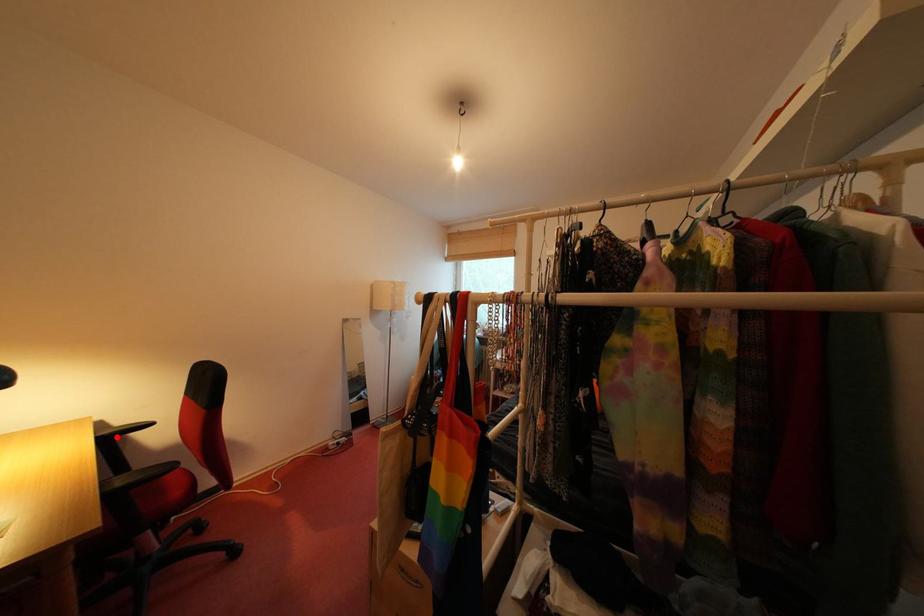
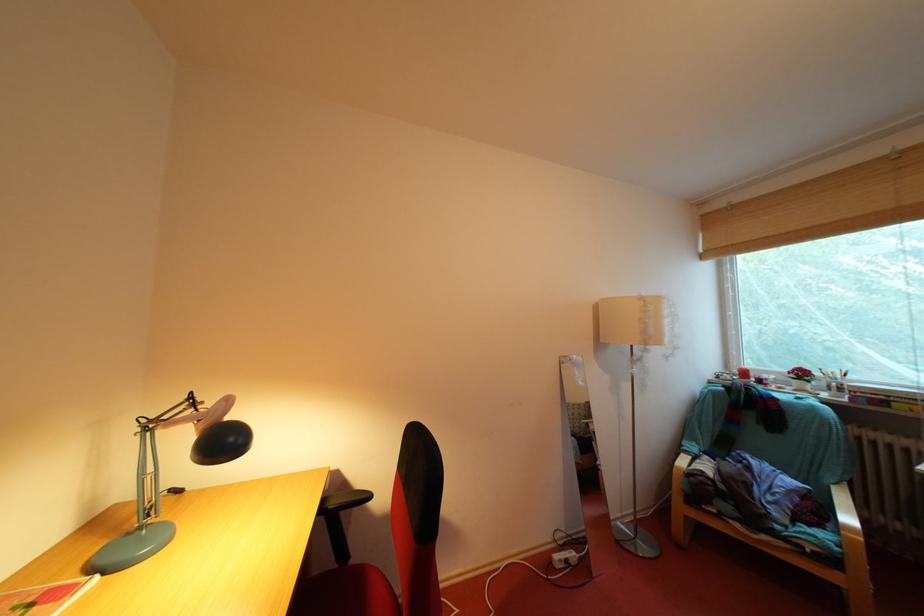
In the second image, find the point that corresponds to the highlighted location in the first image.

(342, 508)